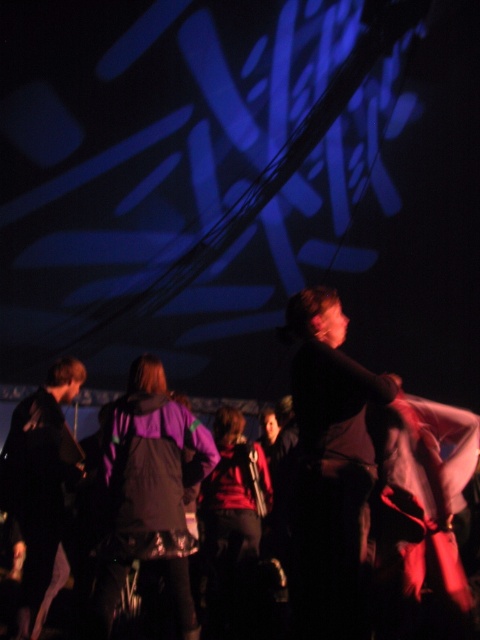
Question: In this image, where is dark fabric shirt at center located relative to purple matte jacket at center?

Choices:
 (A) right
 (B) left

Answer: (A)

Question: Does dark fabric shirt at center come in front of purple matte jacket at center?

Choices:
 (A) no
 (B) yes

Answer: (B)

Question: Which object appears farthest from the camera in this image?

Choices:
 (A) dark fabric shirt at center
 (B) black matte jacket at center
 (C) black matte jacket at lower left

Answer: (C)

Question: Which point is closer to the camera?

Choices:
 (A) purple matte jacket at center
 (B) black matte jacket at lower left
 (C) dark fabric shirt at center

Answer: (C)

Question: Which point is closer to the camera?

Choices:
 (A) [367, 433]
 (B) [49, 432]
 (C) [301, 352]
 (D) [192, 541]

Answer: (A)

Question: Does dark fabric shirt at center appear over black matte jacket at lower left?

Choices:
 (A) no
 (B) yes

Answer: (B)